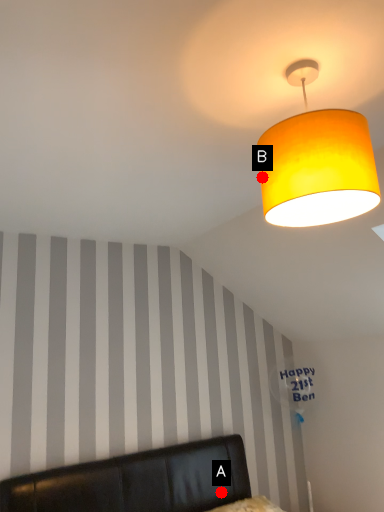
Question: Two points are circled on the image, labeled by A and B beside each circle. Among these points, which one is nearest to the camera?

Choices:
 (A) A is closer
 (B) B is closer

Answer: (B)